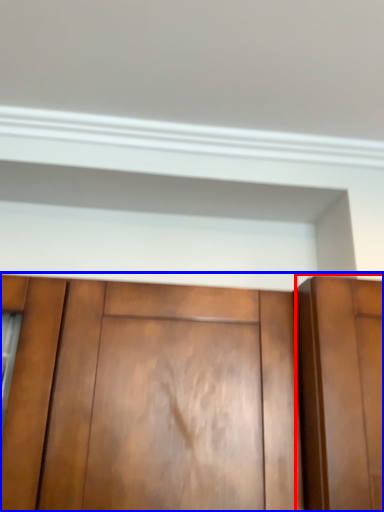
Question: Which object appears closest to the camera in this image, door (highlighted by a red box) or cupboard (highlighted by a blue box)?

Choices:
 (A) door
 (B) cupboard

Answer: (A)